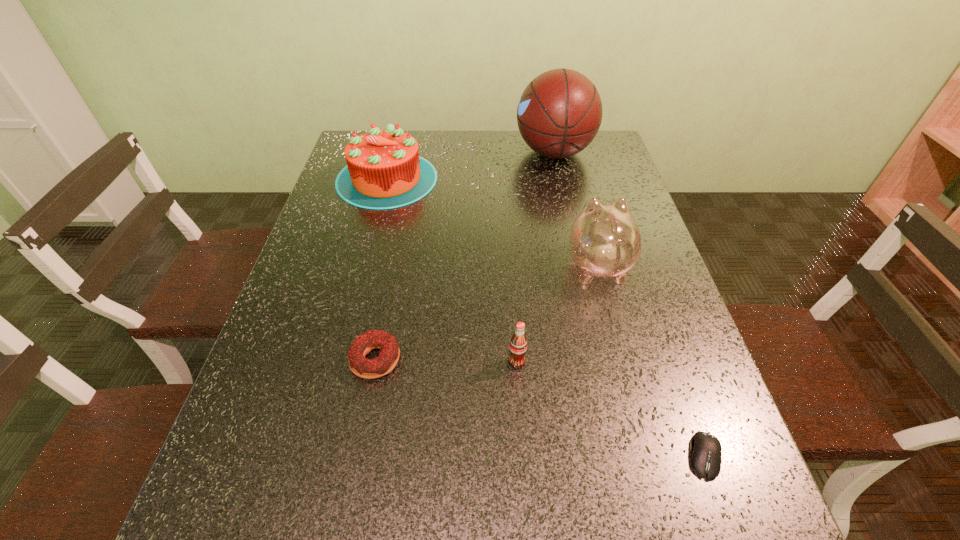
Identify the location of object that ranks as the second closest to the fourth nearest object. (559, 113).